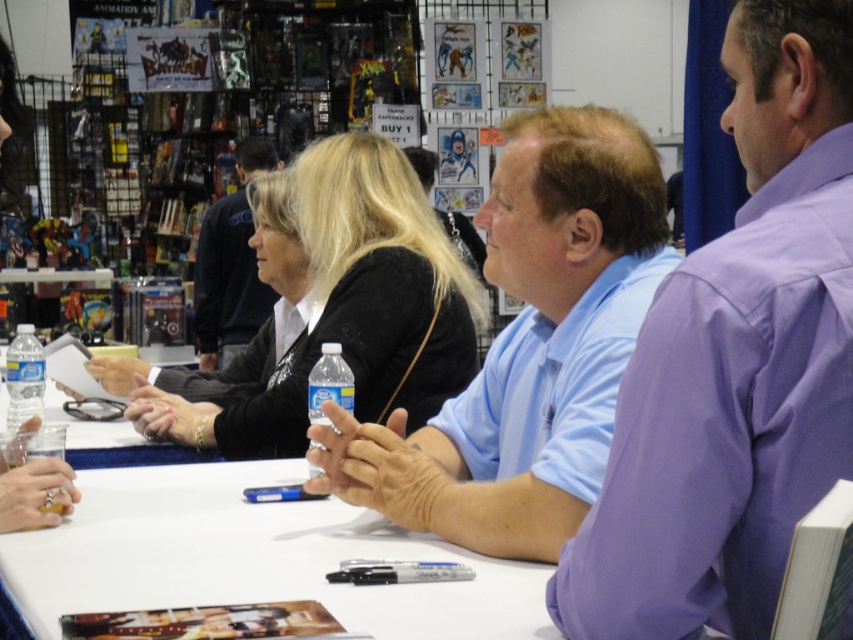
Question: Is light blue shirt at center behind clear plastic water bottle at left?

Choices:
 (A) yes
 (B) no

Answer: (B)

Question: Does purple cotton shirt at right have a lesser width compared to white paper at center?

Choices:
 (A) yes
 (B) no

Answer: (A)

Question: Which object is positioned farthest from the clear plastic water bottle at center?

Choices:
 (A) light blue shirt at center
 (B) black matte jacket at center
 (C) white paper at center

Answer: (A)

Question: Does purple cotton shirt at right have a lesser width compared to black matte jacket at center?

Choices:
 (A) no
 (B) yes

Answer: (B)

Question: Which object is the farthest from the black matte jacket at center?

Choices:
 (A) clear plastic water bottle at center
 (B) clear plastic water bottle at left
 (C) light brown hair at center

Answer: (C)

Question: Estimate the real-world distances between objects in this image. Which object is closer to the black matte jacket at center?

Choices:
 (A) white paper at center
 (B) clear plastic water bottle at left
 (C) light brown hair at center

Answer: (A)